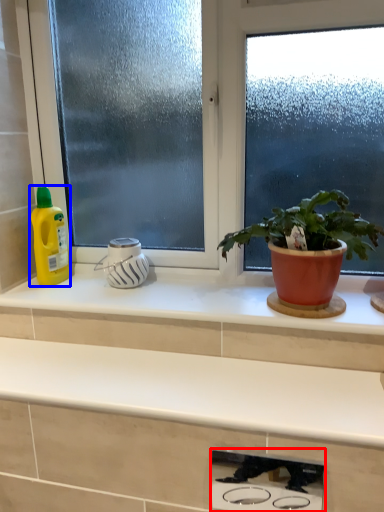
Question: Which object is closer to the camera taking this photo, appliance (highlighted by a red box) or cleaning product (highlighted by a blue box)?

Choices:
 (A) appliance
 (B) cleaning product

Answer: (A)